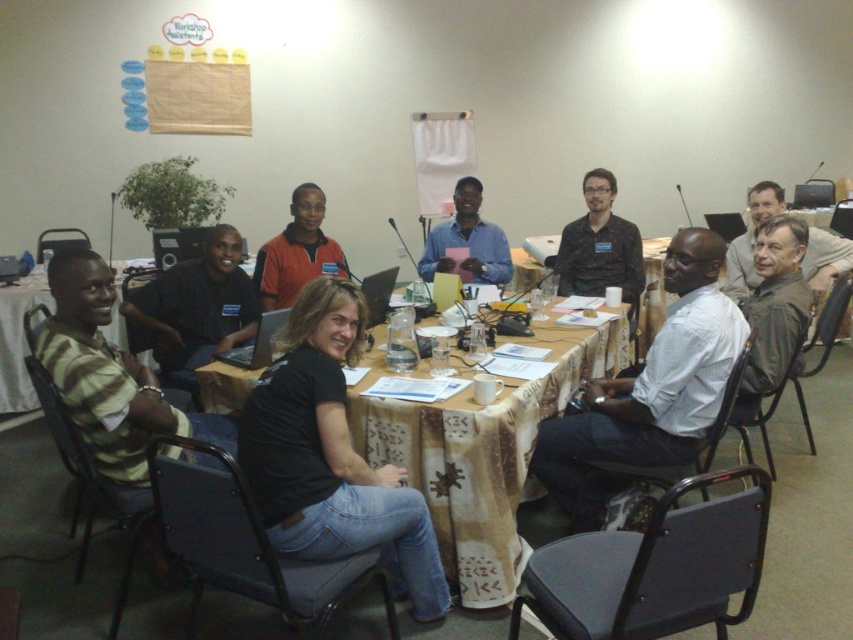
Question: Which object is farther from the camera taking this photo?

Choices:
 (A) gray fabric shirt at upper right
 (B) wooden table at center
 (C) white shirt at center
 (D) orange matte shirt at center

Answer: (D)

Question: Can you confirm if matte black shirt at center is positioned to the left of orange matte shirt at center?

Choices:
 (A) yes
 (B) no

Answer: (A)

Question: Which object is positioned farthest from the wooden table at center?

Choices:
 (A) matte black shirt at center
 (B) white shirt at center
 (C) orange matte shirt at center

Answer: (C)

Question: Among these objects, which one is farthest from the camera?

Choices:
 (A) wooden table at center
 (B) gray fabric shirt at upper right
 (C) matte black shirt at center
 (D) blue shirt at center

Answer: (D)

Question: Observing the image, what is the correct spatial positioning of matte black shirt at center in reference to orange matte shirt at center?

Choices:
 (A) right
 (B) left

Answer: (B)

Question: Is orange matte shirt at center further to the viewer compared to blue shirt at center?

Choices:
 (A) no
 (B) yes

Answer: (A)